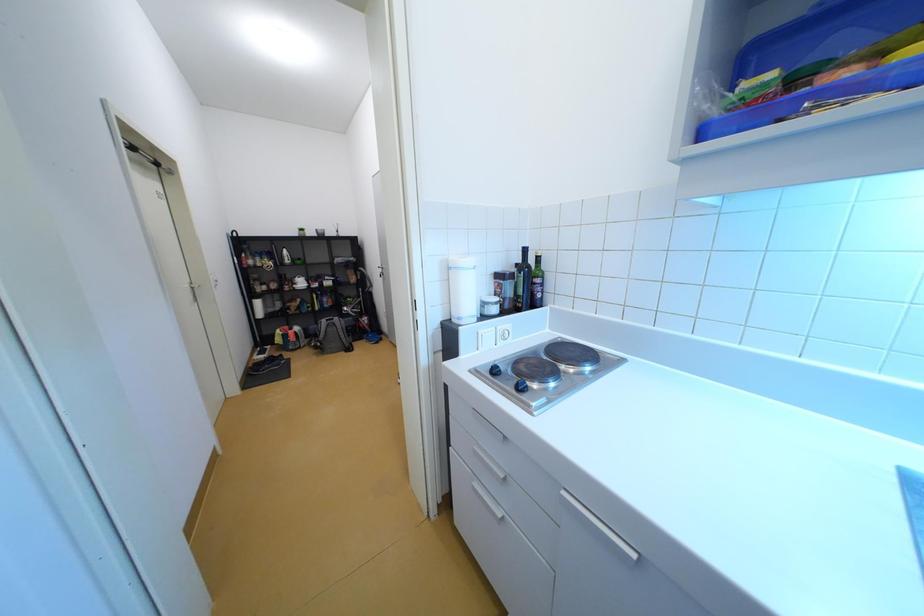
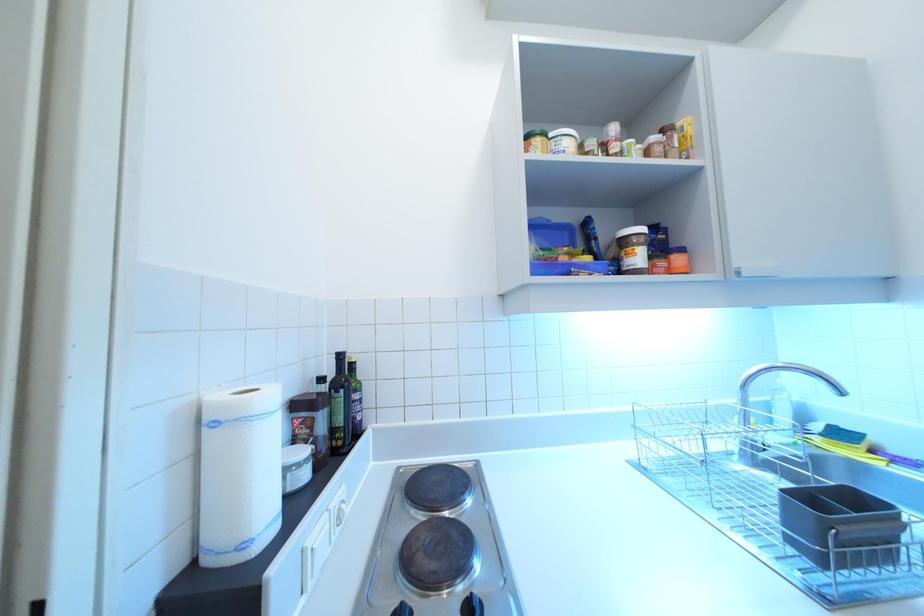
Question: How did the camera likely rotate?

Choices:
 (A) Left
 (B) Right
 (C) Up
 (D) Down

Answer: (B)